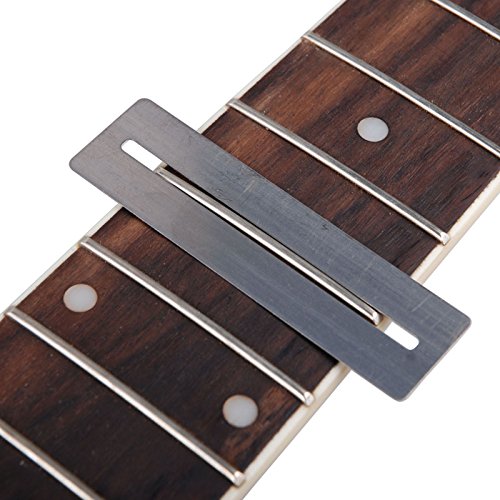
Find the location of a particular element. partitioning is located at coordinates (295, 258), (224, 336), (132, 398), (37, 457), (406, 92), (351, 174).